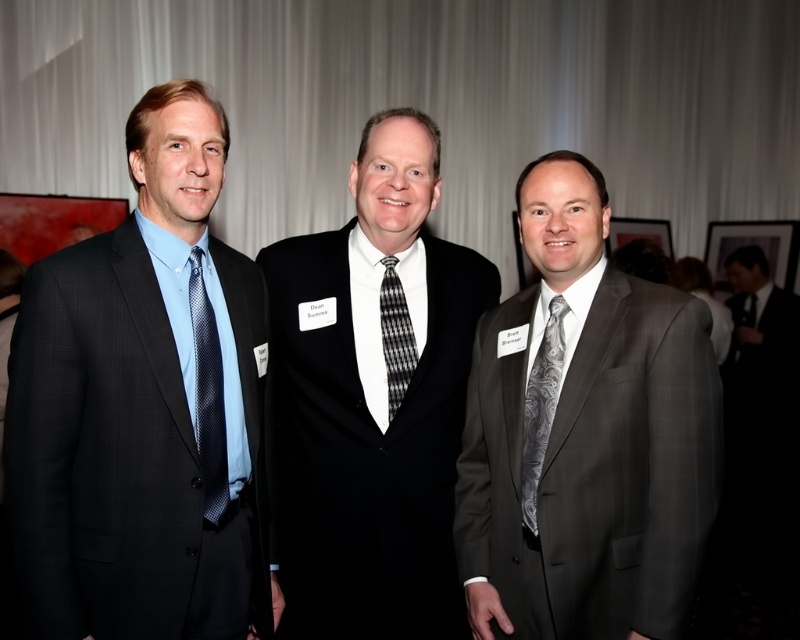
Who is more forward, (446, 612) or (204, 464)?

Point (204, 464) is more forward.

Is black wool suit at center to the left of blue dotted tie at left from the viewer's perspective?

No, black wool suit at center is not to the left of blue dotted tie at left.

Which is behind, point (300, 269) or point (193, 294)?

The point (300, 269) is behind.

Where is `black wool suit at center`? The image size is (800, 640). black wool suit at center is located at coordinates (374, 397).

Does matte black suit at left have a larger size compared to gray textured suit at center?

Correct, matte black suit at left is larger in size than gray textured suit at center.

How much distance is there between matte black suit at left and gray textured suit at center?

matte black suit at left and gray textured suit at center are 27.82 inches apart.

At what (x,y) coordinates should I click in order to perform the action: click on matte black suit at left. Please return your answer as a coordinate pair (x, y). The width and height of the screenshot is (800, 640). Looking at the image, I should click on (146, 408).

Between point (220, 442) and point (544, 454), which one is positioned in front?

Point (220, 442) is more forward.

Where is `blue dotted tie at left`? The image size is (800, 640). blue dotted tie at left is located at coordinates click(x=208, y=396).

The image size is (800, 640). Find the location of `blue dotted tie at left`. blue dotted tie at left is located at coordinates (208, 396).